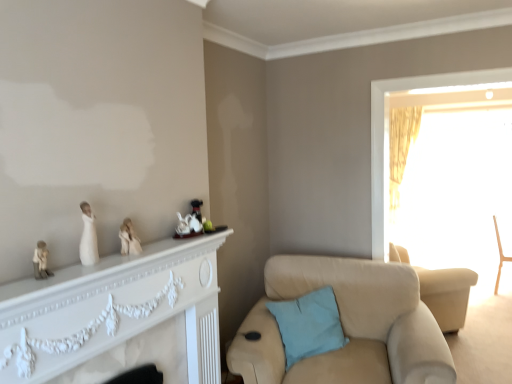
Image resolution: width=512 pixels, height=384 pixels. I want to click on free point in front of white matte figurine at left, placed as the first toy when sorted from front to back, so click(30, 289).